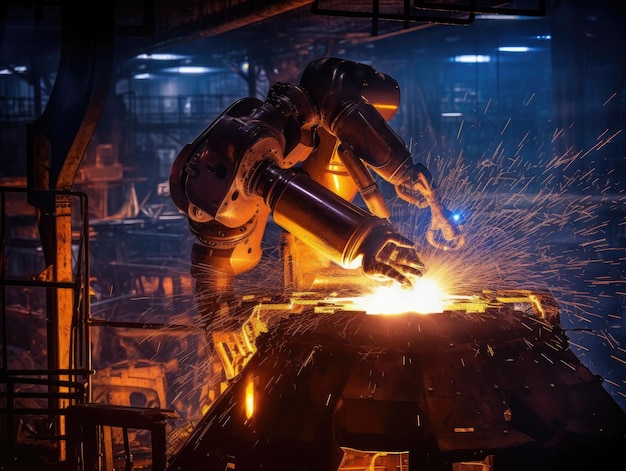
Locate an element on the screen. ceiling light is located at coordinates (468, 57), (519, 50), (546, 37), (190, 70), (155, 61), (146, 78), (244, 64), (9, 70).